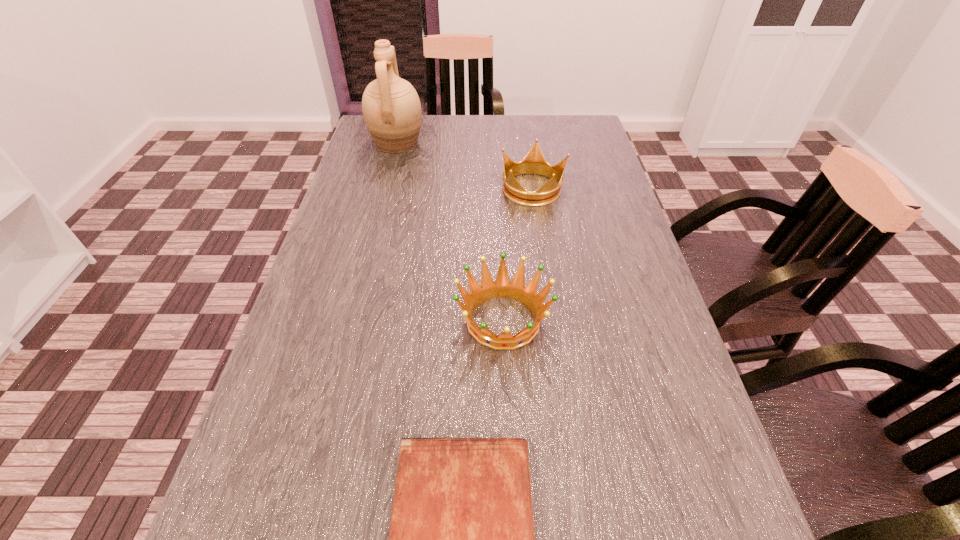
At what (x,y) coordinates should I click in order to perform the action: click on the farthest object. Please return your answer as a coordinate pair (x, y). The height and width of the screenshot is (540, 960). Looking at the image, I should click on (391, 108).

Identify the location of the tallest object. point(391,108).

At what (x,y) coordinates should I click in order to perform the action: click on the farther crown. Please return your answer as a coordinate pair (x, y). Looking at the image, I should click on (534, 162).

The height and width of the screenshot is (540, 960). What are the coordinates of `the second nearest object` in the screenshot? It's located at (502, 287).

Find the location of a particular element. free space located on the front of the pitcher is located at coordinates (386, 186).

Locate an element on the screen. vacant space situated 0.370m on the left of the second farthest object is located at coordinates (369, 188).

The width and height of the screenshot is (960, 540). Find the location of `vacant region located 0.320m on the back of the nearer crown`. vacant region located 0.320m on the back of the nearer crown is located at coordinates (497, 199).

Locate an element on the screen. object present at the far edge is located at coordinates (391, 108).

I want to click on object situated at the left edge, so click(x=391, y=108).

In order to click on object that is at the right edge in this screenshot , I will do `click(534, 162)`.